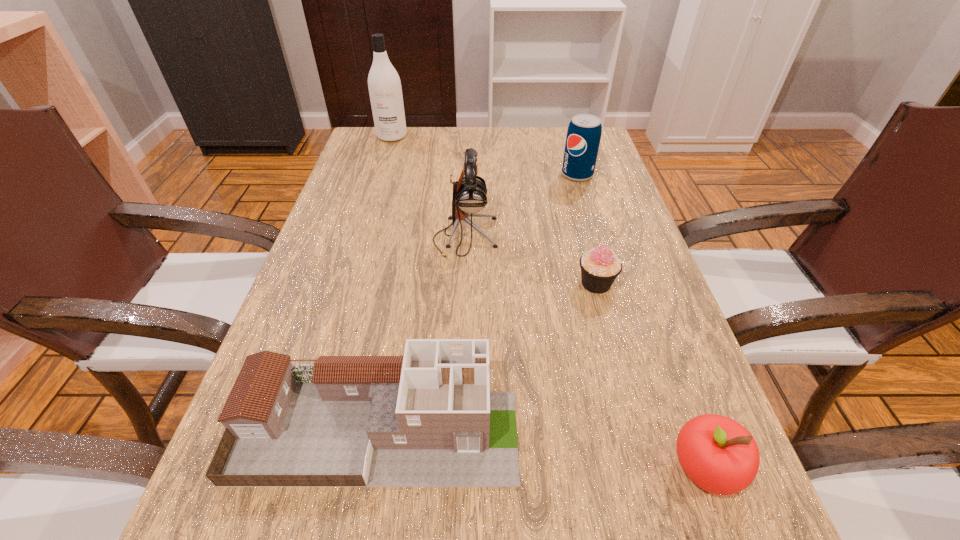
Locate an element on the screen. This screenshot has width=960, height=540. apple positioned at the right edge is located at coordinates (718, 454).

Identify the location of cupcake located in the right edge section of the desktop. The height and width of the screenshot is (540, 960). (599, 267).

This screenshot has height=540, width=960. Identify the location of object at the far left corner. (384, 84).

You are a GUI agent. You are given a task and a screenshot of the screen. Output one action in this format:
    pyautogui.click(x=<x>, y=<y>)
    Task: Click on the object that is at the far right corner
    Image resolution: width=960 pixels, height=540 pixels.
    Given the screenshot: What is the action you would take?
    pyautogui.click(x=583, y=137)

Find the location of a particular element. This screenshot has width=960, height=540. free location at the far edge is located at coordinates (449, 138).

In the image, there is a desktop. Where is `vacant space at the left edge`? Image resolution: width=960 pixels, height=540 pixels. vacant space at the left edge is located at coordinates point(305,268).

In the image, there is a desktop. Identify the location of vacant region at the right edge. The image size is (960, 540). (672, 522).

This screenshot has width=960, height=540. Find the location of `vacant space in between the shortest object and the earphone`. vacant space in between the shortest object and the earphone is located at coordinates (531, 260).

Find the location of a particular element. free spot between the apple and the earphone is located at coordinates (585, 353).

The width and height of the screenshot is (960, 540). Find the location of `free area in between the shampoo and the apple`. free area in between the shampoo and the apple is located at coordinates (548, 303).